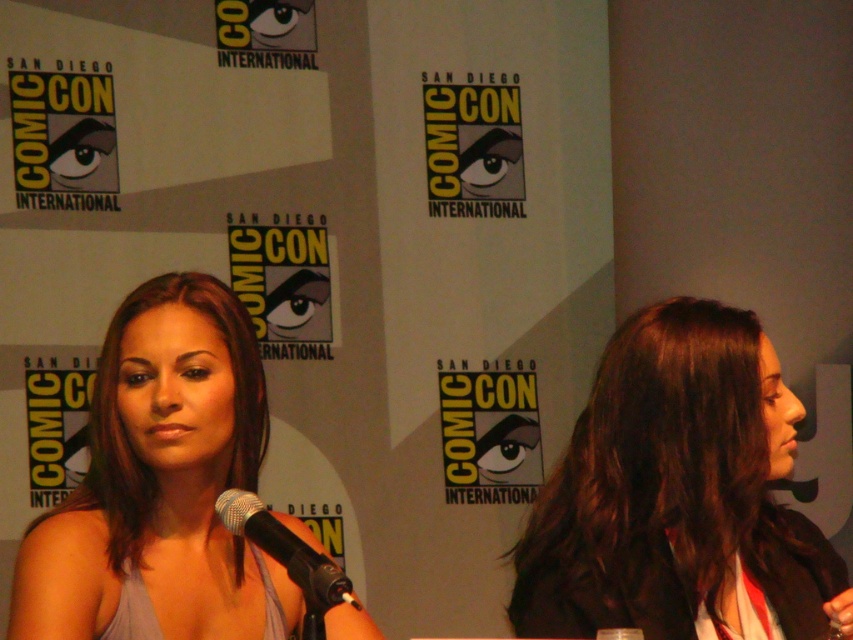
You are a photographer at Comic Con and need to capture a closeup of the dark brown hair at center and the matte gray dress at center. Which object should you zoom in on to ensure it takes up more space in the photo?

The matte gray dress at center should be zoomed in on because it has a greater width than the dark brown hair at center, making it larger and thus requiring closer focus to fill the frame appropriately.